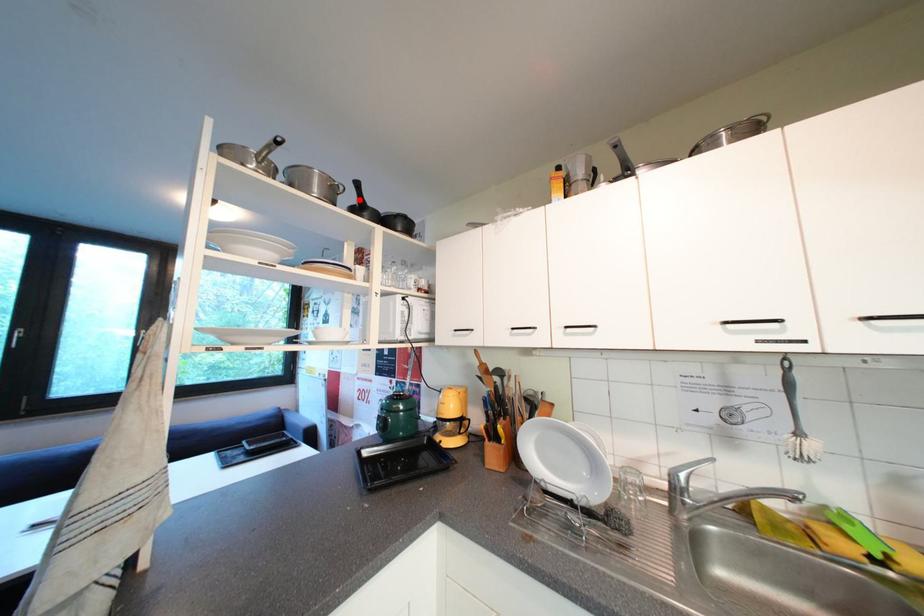
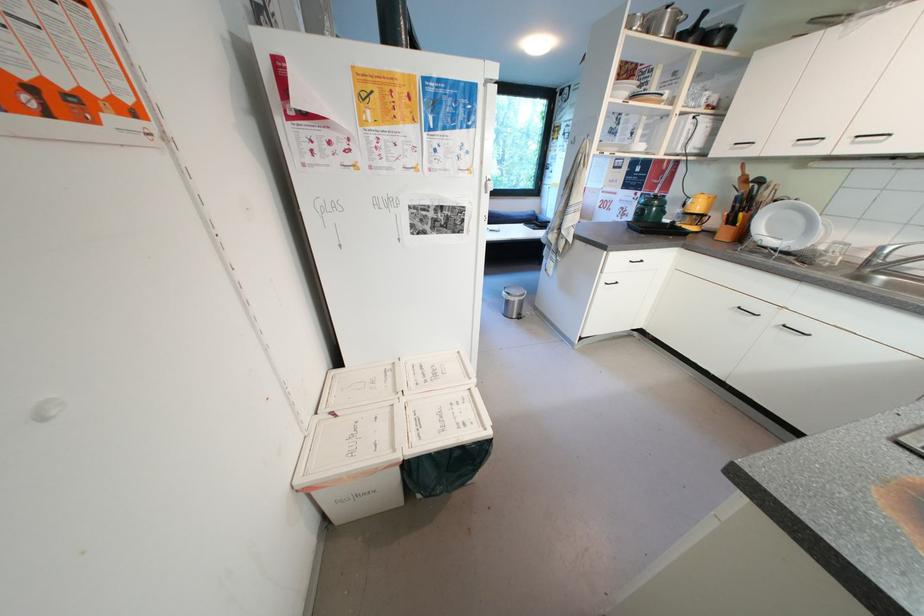
In the second image, find the point that corresponds to the highlighted location in the first image.

(697, 26)